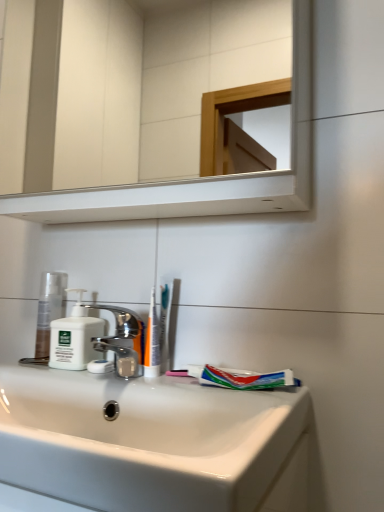
Question: Does white glossy sink at lower center have a greater width compared to white glossy mirror at upper center?

Choices:
 (A) yes
 (B) no

Answer: (A)

Question: Is white glossy sink at lower center taller than white glossy mirror at upper center?

Choices:
 (A) no
 (B) yes

Answer: (A)

Question: Is white glossy sink at lower center facing away from white glossy mirror at upper center?

Choices:
 (A) yes
 (B) no

Answer: (B)

Question: Can you confirm if white glossy sink at lower center is positioned to the left of white glossy mirror at upper center?

Choices:
 (A) no
 (B) yes

Answer: (B)

Question: Considering the relative sizes of white glossy sink at lower center and white glossy mirror at upper center in the image provided, is white glossy sink at lower center smaller than white glossy mirror at upper center?

Choices:
 (A) yes
 (B) no

Answer: (A)

Question: Considering the positions of point (158, 366) and point (253, 376), is point (158, 366) closer or farther from the camera than point (253, 376)?

Choices:
 (A) farther
 (B) closer

Answer: (A)

Question: Considering their positions, is white plastic toothbrush at center located in front of or behind multicolored plastic toothpaste at lower center?

Choices:
 (A) behind
 (B) front

Answer: (A)

Question: Is white plastic toothbrush at center situated inside multicolored plastic toothpaste at lower center or outside?

Choices:
 (A) outside
 (B) inside

Answer: (A)

Question: From the image's perspective, is white plastic toothbrush at center located above or below multicolored plastic toothpaste at lower center?

Choices:
 (A) above
 (B) below

Answer: (A)

Question: From a real-world perspective, relative to matte white lotion at left, is white plastic toothbrush at center vertically above or below?

Choices:
 (A) above
 (B) below

Answer: (A)

Question: Is point (157, 372) positioned closer to the camera than point (61, 288)?

Choices:
 (A) closer
 (B) farther

Answer: (A)

Question: Considering their positions, is white plastic toothbrush at center located in front of or behind matte white lotion at left?

Choices:
 (A) front
 (B) behind

Answer: (A)

Question: Based on their sizes in the image, would you say white plastic toothbrush at center is bigger or smaller than matte white lotion at left?

Choices:
 (A) small
 (B) big

Answer: (A)

Question: From the image's perspective, is white plastic toothbrush at center above or below white glossy mirror at upper center?

Choices:
 (A) below
 (B) above

Answer: (A)

Question: Is white plastic toothbrush at center to the left or to the right of white glossy mirror at upper center in the image?

Choices:
 (A) left
 (B) right

Answer: (B)